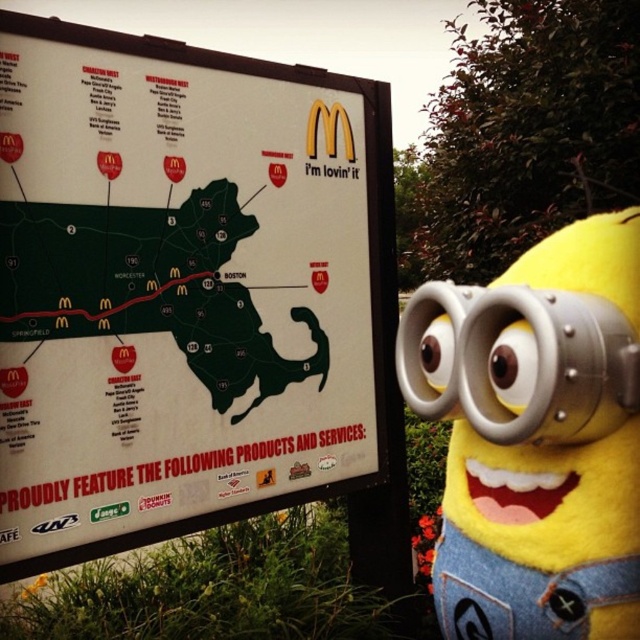
What is the spatial relationship between the green matte map at center and the silver metallic goggles at center?

The green matte map at center is to the left of the silver metallic goggles at center.

What is the spatial relationship between the silver metallic goggles at center and the white paper map at upper center?

The silver metallic goggles at center is behind the white paper map at upper center.